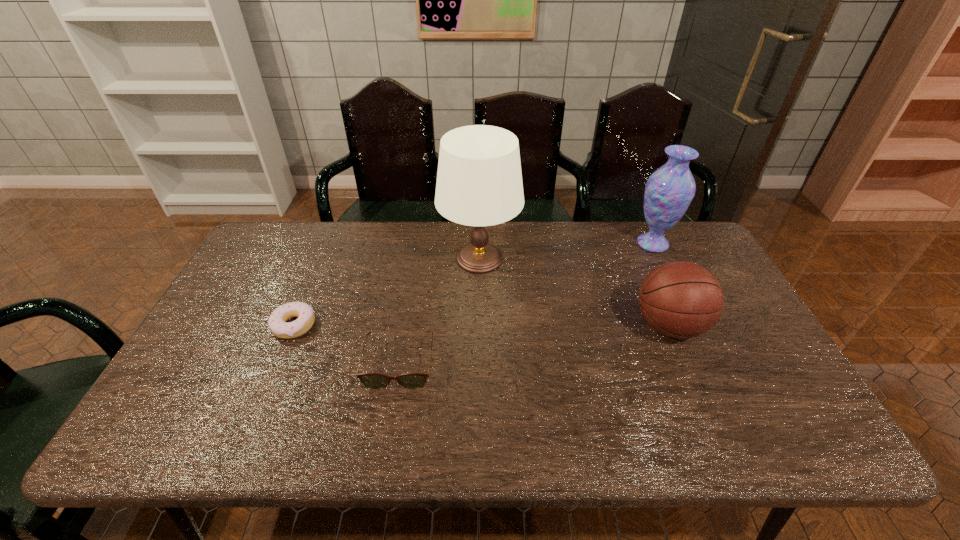
This screenshot has height=540, width=960. I want to click on vacant region at the near left corner of the desktop, so click(188, 423).

Locate an element on the screen. vacant point located between the third tallest object and the second shortest object is located at coordinates (535, 345).

Locate an element on the screen. free spot between the spectacles and the leftmost object is located at coordinates (347, 345).

Identify the location of blank region between the tallest object and the fourth shortest object. This screenshot has height=540, width=960. (566, 251).

You are a GUI agent. You are given a task and a screenshot of the screen. Output one action in this format:
    pyautogui.click(x=<x>, y=<y>)
    Task: Click on the unoccupied position between the lamp and the fourth shortest object
    
    Given the screenshot: What is the action you would take?
    pyautogui.click(x=566, y=251)

Identify the location of free spot between the leftmost object and the spectacles. (347, 345).

Identify the location of free space between the leftmost object and the spectacles. This screenshot has width=960, height=540. pyautogui.click(x=347, y=345).

Where is `free area in between the basketball and the shortest object`? The width and height of the screenshot is (960, 540). free area in between the basketball and the shortest object is located at coordinates (482, 326).

The height and width of the screenshot is (540, 960). What are the coordinates of `free space between the fourth shortest object and the tallest object` in the screenshot? It's located at (566, 251).

Where is `the fourth closest object to the second shortest object`? The width and height of the screenshot is (960, 540). the fourth closest object to the second shortest object is located at coordinates (669, 190).